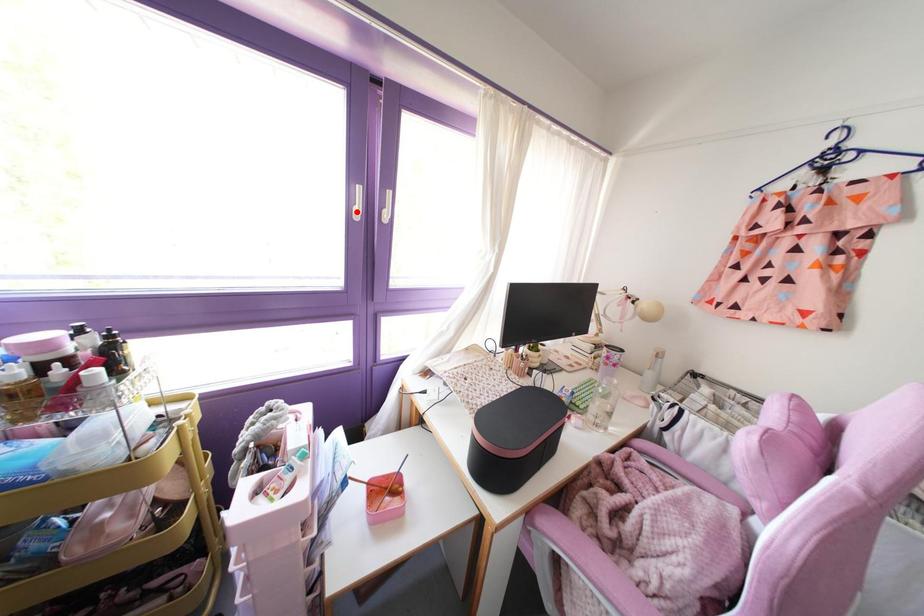
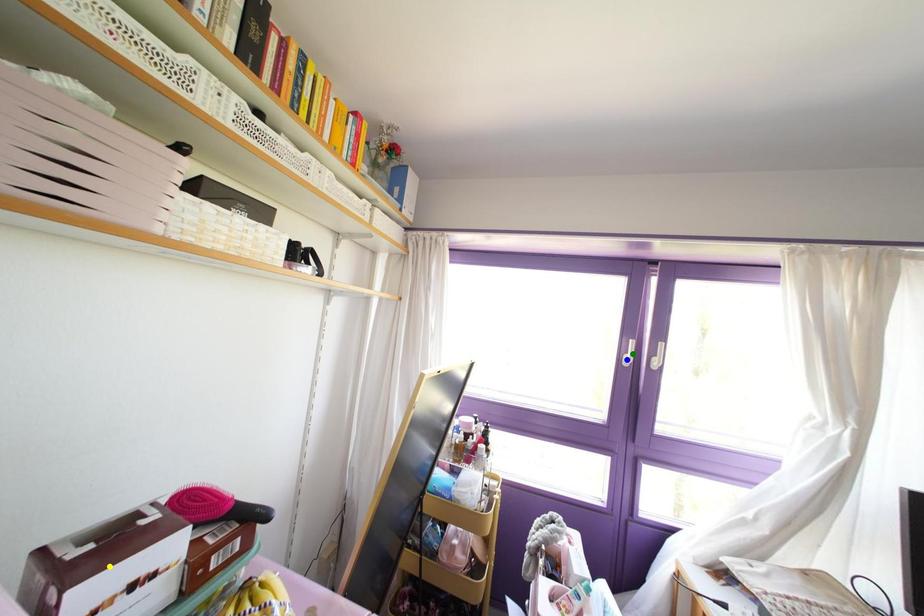
Question: I am providing you with two images of the same scene from different viewpoints. A red point is marked on the first image. You are given multiple points on the second image. In image 2, which mark is for the same physical point as the one in image 1?

Choices:
 (A) blue point
 (B) green point
 (C) yellow point

Answer: (A)